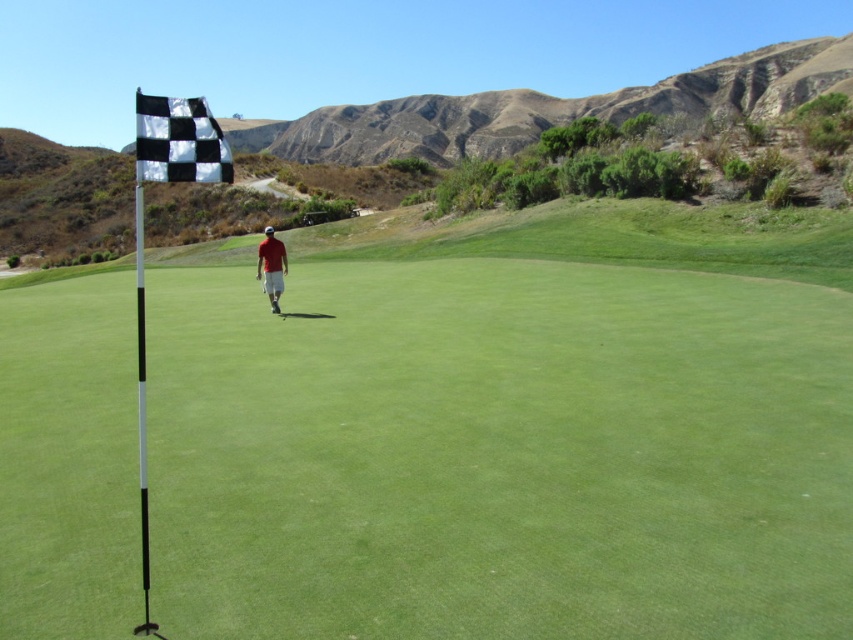
In the scene shown: Which is more to the left, black checkered flag at upper left or red matte shirt at center?

red matte shirt at center is more to the left.

Does point (160, 115) lie behind point (262, 284)?

No, it is not.

Identify the location of black checkered flag at upper left. (178, 141).

Is white plastic flag at left thinner than black checkered flag at upper left?

In fact, white plastic flag at left might be wider than black checkered flag at upper left.

Does white plastic flag at left lie in front of black checkered flag at upper left?

No, white plastic flag at left is further to the viewer.

Where is `white plastic flag at left`? white plastic flag at left is located at coordinates (508, 428).

Who is more forward, (589, 572) or (274, 310)?

Point (589, 572) is more forward.

Does white plastic flag at left appear over red matte shirt at center?

Yes.

Is point (846, 577) closer to viewer compared to point (260, 269)?

That is True.

The width and height of the screenshot is (853, 640). What are the coordinates of `white plastic flag at left` in the screenshot? It's located at (508, 428).